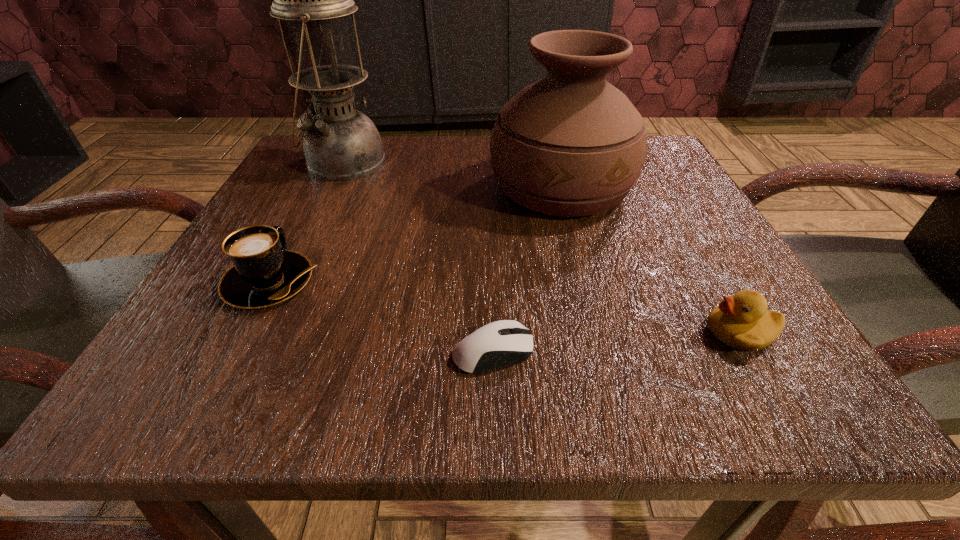
This screenshot has height=540, width=960. I want to click on oil lamp, so click(340, 143).

Where is `the second tallest object`? Image resolution: width=960 pixels, height=540 pixels. the second tallest object is located at coordinates (571, 144).

Where is `cappuccino`? cappuccino is located at coordinates (264, 273).

You are a GUI agent. You are given a task and a screenshot of the screen. Output one action in this format:
    pyautogui.click(x=<x>, y=<y>)
    Task: Click on the rightmost object
    The width and height of the screenshot is (960, 540).
    Given the screenshot: What is the action you would take?
    pyautogui.click(x=742, y=321)

I want to click on the shortest object, so click(x=501, y=343).

Find the location of a particular element. vacant region located on the right of the tallest object is located at coordinates (584, 162).

In order to click on vacant region located on the front of the second tallest object in this screenshot , I will do `click(597, 323)`.

Locate an element on the screen. This screenshot has width=960, height=540. free space located 0.190m on the right of the cappuccino is located at coordinates (452, 282).

This screenshot has width=960, height=540. I want to click on vacant space positioned on the front-facing side of the rightmost object, so click(519, 332).

The height and width of the screenshot is (540, 960). In order to click on vacant point located 0.130m on the front-facing side of the rightmost object in this screenshot , I will do `click(601, 332)`.